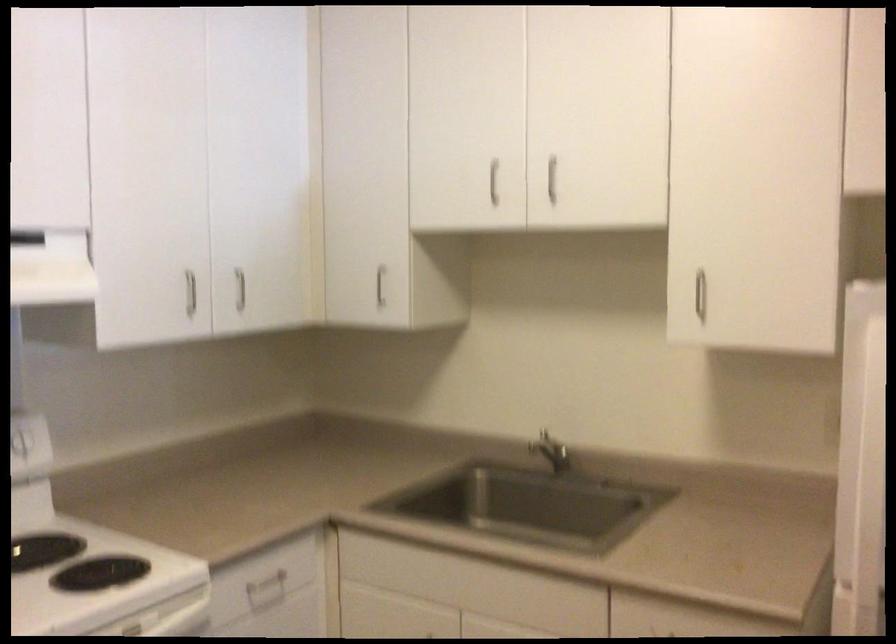
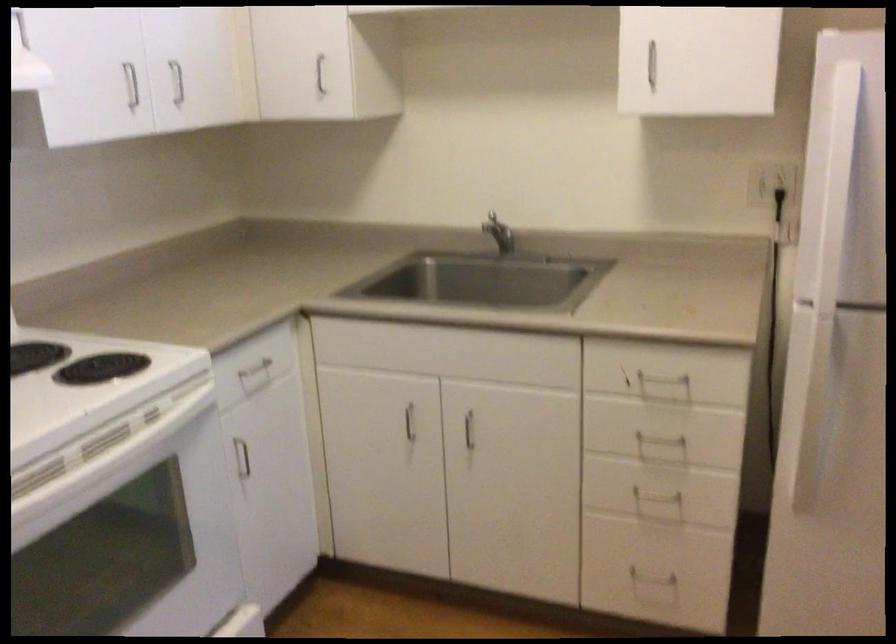
In the second image, find the point that corresponds to pixel 382 283 in the first image.

(319, 75)